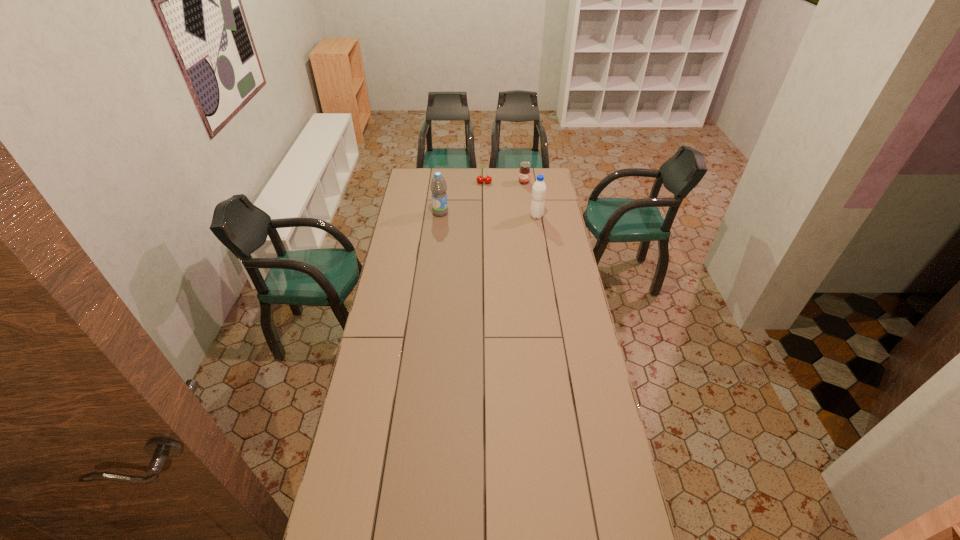
This screenshot has width=960, height=540. What are the coordinates of `free spot on the desktop that is between the leftmost object and the right water bottle and is positioned with the stems of the third object from right to left pointing upwards` in the screenshot? It's located at (480, 214).

This screenshot has width=960, height=540. Identify the location of vacant space on the desktop that is between the left water bottle and the right water bottle and is positioned on the label side of the jam. (498, 215).